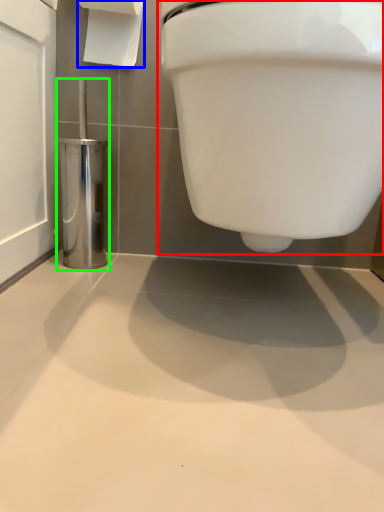
Question: Which object is positioned closest to toilet (highlighted by a red box)? Select from toilet paper (highlighted by a blue box) and porcelain (highlighted by a green box).

Choices:
 (A) toilet paper
 (B) porcelain

Answer: (B)